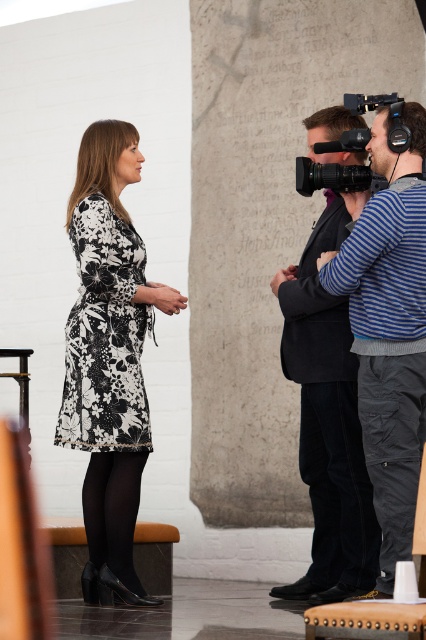
From the picture: Is black floral dress at left below dark gray suit at right?

No, black floral dress at left is not below dark gray suit at right.

Does black floral dress at left appear on the left side of dark gray suit at right?

Indeed, black floral dress at left is positioned on the left side of dark gray suit at right.

I want to click on black floral dress at left, so click(109, 358).

Is blue striped sweater at right further to the viewer compared to dark gray suit at right?

No, it is not.

The image size is (426, 640). Identify the location of blue striped sweater at right. (388, 326).

Does point (362, 442) come farther from viewer compared to point (317, 579)?

No, it is not.

Identify the location of blue striped sweater at right. The height and width of the screenshot is (640, 426). (388, 326).

What do you see at coordinates (388, 326) in the screenshot?
I see `blue striped sweater at right` at bounding box center [388, 326].

Is blue striped sweater at right shorter than dark gray cotton pants at lower right?

No, blue striped sweater at right is not shorter than dark gray cotton pants at lower right.

Is point (380, 483) positioned in front of point (379, 557)?

That is True.

The width and height of the screenshot is (426, 640). I want to click on blue striped sweater at right, so click(388, 326).